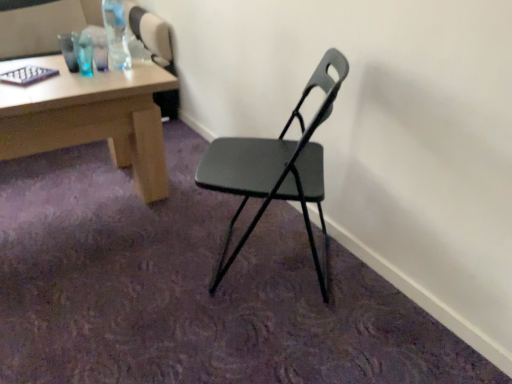
Question: Is matte wood desk at upper left looking in the opposite direction of matte black chair at center?

Choices:
 (A) yes
 (B) no

Answer: (B)

Question: From the image's perspective, is matte wood desk at upper left under matte black chair at center?

Choices:
 (A) yes
 (B) no

Answer: (B)

Question: Is matte wood desk at upper left to the right of matte black chair at center from the viewer's perspective?

Choices:
 (A) no
 (B) yes

Answer: (A)

Question: From the image's perspective, does matte wood desk at upper left appear higher than matte black chair at center?

Choices:
 (A) no
 (B) yes

Answer: (B)

Question: Does matte wood desk at upper left have a greater width compared to matte black chair at center?

Choices:
 (A) no
 (B) yes

Answer: (B)

Question: Can you confirm if matte wood desk at upper left is shorter than matte black chair at center?

Choices:
 (A) yes
 (B) no

Answer: (A)

Question: Is clear plastic bottle at upper left at the back of matte wood desk at upper left?

Choices:
 (A) yes
 (B) no

Answer: (B)

Question: Does matte wood desk at upper left have a greater width compared to clear plastic bottle at upper left?

Choices:
 (A) yes
 (B) no

Answer: (A)

Question: Is matte wood desk at upper left touching clear plastic bottle at upper left?

Choices:
 (A) yes
 (B) no

Answer: (B)

Question: Considering the relative sizes of matte wood desk at upper left and clear plastic bottle at upper left in the image provided, is matte wood desk at upper left bigger than clear plastic bottle at upper left?

Choices:
 (A) yes
 (B) no

Answer: (A)

Question: Considering the relative sizes of matte wood desk at upper left and clear plastic bottle at upper left in the image provided, is matte wood desk at upper left smaller than clear plastic bottle at upper left?

Choices:
 (A) yes
 (B) no

Answer: (B)

Question: Is clear plastic bottle at upper left a part of matte wood desk at upper left?

Choices:
 (A) no
 (B) yes

Answer: (A)

Question: Considering the relative sizes of matte black chair at center and matte wood desk at upper left in the image provided, is matte black chair at center bigger than matte wood desk at upper left?

Choices:
 (A) yes
 (B) no

Answer: (B)